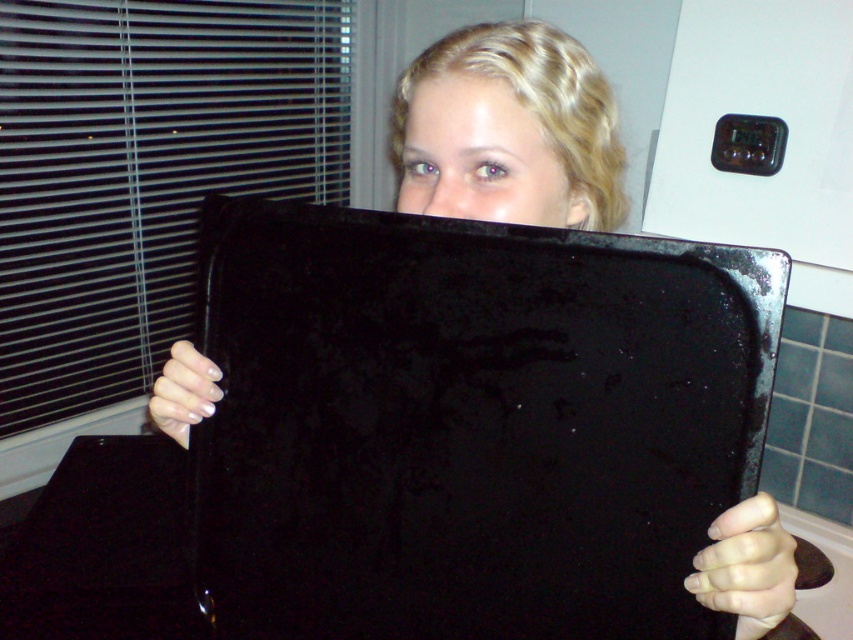
You are standing in a room and see the black matte blind at left and the matte black tray at center. Which object is located to the left of the other?

The black matte blind at left is positioned on the left side of matte black tray at center.

You are an interior designer assessing the lighting in a room. You notice the black matte blind at left and the matte black face at upper center. Which object is located to the left of the other?

The black matte blind at left is positioned on the left side of matte black face at upper center.

You are trying to determine if the black matte blind at left can block the entire view of the matte black tray at center. Based on their sizes, what do you think?

The black matte blind at left is larger in size than the matte black tray at center, so it can potentially block the entire view of the matte black tray at center if positioned correctly.